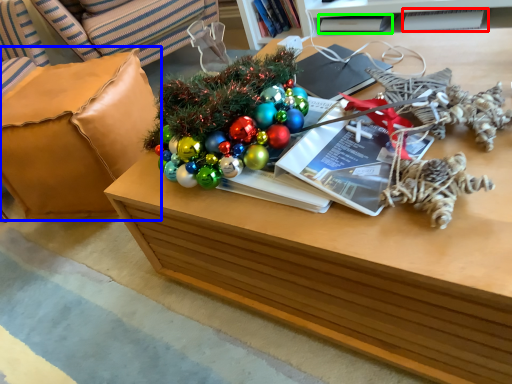
Question: Based on their relative distances, which object is farther from magazine (highlighted by a red box)? Choose from armchair (highlighted by a blue box) and book (highlighted by a green box).

Choices:
 (A) armchair
 (B) book

Answer: (A)